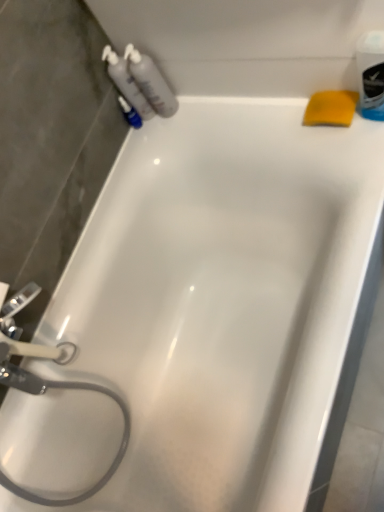
What are the coordinates of `free space in front of translucent plastic bottles at upper left, which is the 2th cleaning product in right-to-left order` in the screenshot? It's located at (189, 121).